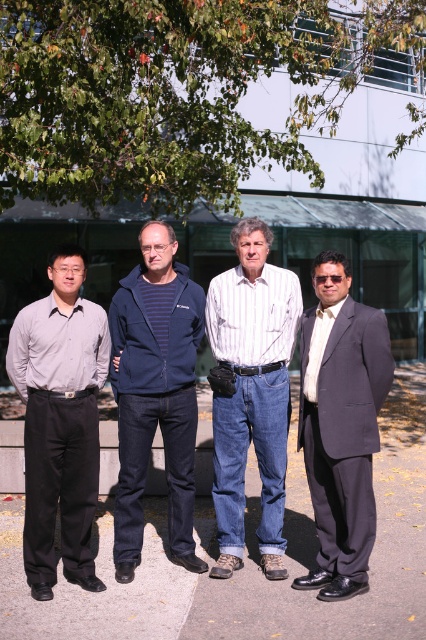
Who is more distant from viewer, (66, 323) or (385, 381)?

Positioned behind is point (66, 323).

Who is positioned more to the right, matte gray shirt at left or dark blue suit at right?

Positioned to the right is dark blue suit at right.

Which is behind, point (40, 429) or point (365, 518)?

The point (40, 429) is more distant.

At what (x,y) coordinates should I click in order to perform the action: click on matte gray shirt at left. Please return your answer as a coordinate pair (x, y). This screenshot has height=640, width=426. Looking at the image, I should click on (60, 420).

Who is positioned more to the right, green leafy tree at upper center or dark blue suit at right?

dark blue suit at right is more to the right.

Can you confirm if green leafy tree at upper center is positioned below dark blue suit at right?

Actually, green leafy tree at upper center is above dark blue suit at right.

What do you see at coordinates (175, 92) in the screenshot?
I see `green leafy tree at upper center` at bounding box center [175, 92].

Where is `green leafy tree at upper center`? green leafy tree at upper center is located at coordinates (175, 92).

Does green leafy tree at upper center appear on the left side of navy blue jacket at center?

In fact, green leafy tree at upper center is to the right of navy blue jacket at center.

Does green leafy tree at upper center have a greater width compared to navy blue jacket at center?

Yes, green leafy tree at upper center is wider than navy blue jacket at center.

Who is more distant from viewer, (x=94, y=93) or (x=184, y=317)?

Positioned behind is point (x=94, y=93).

Find the location of a particular element. This screenshot has width=426, height=640. green leafy tree at upper center is located at coordinates (175, 92).